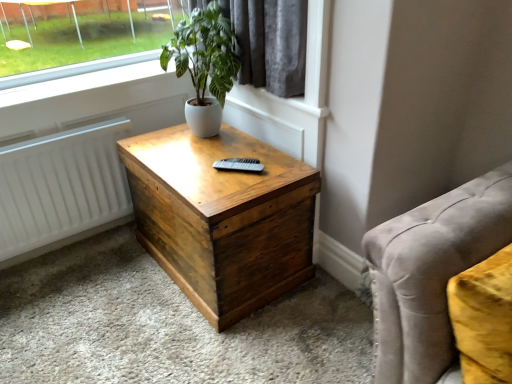
Question: From the image's perspective, is wooden nightstand at center on white matte radiator at left?

Choices:
 (A) no
 (B) yes

Answer: (A)

Question: Is wooden nightstand at center at the right side of white matte radiator at left?

Choices:
 (A) yes
 (B) no

Answer: (A)

Question: Can you confirm if wooden nightstand at center is shorter than white matte radiator at left?

Choices:
 (A) no
 (B) yes

Answer: (A)

Question: From a real-world perspective, is wooden nightstand at center under white matte radiator at left?

Choices:
 (A) yes
 (B) no

Answer: (A)

Question: Is white matte radiator at left a part of wooden nightstand at center?

Choices:
 (A) no
 (B) yes

Answer: (A)

Question: Considering the positions of point (36, 173) and point (218, 69), is point (36, 173) closer or farther from the camera than point (218, 69)?

Choices:
 (A) farther
 (B) closer

Answer: (A)

Question: Is white matte radiator at left taller or shorter than green leafy plant at upper center?

Choices:
 (A) tall
 (B) short

Answer: (B)

Question: Is white matte radiator at left in front of or behind green leafy plant at upper center in the image?

Choices:
 (A) front
 (B) behind

Answer: (B)

Question: Visually, is white matte radiator at left positioned to the left or to the right of green leafy plant at upper center?

Choices:
 (A) left
 (B) right

Answer: (A)

Question: Based on their positions, is velvet gray studio couch at lower right located to the left or right of wooden nightstand at center?

Choices:
 (A) right
 (B) left

Answer: (A)

Question: Is velvet gray studio couch at lower right inside the boundaries of wooden nightstand at center, or outside?

Choices:
 (A) outside
 (B) inside

Answer: (A)

Question: Considering the positions of velvet gray studio couch at lower right and wooden nightstand at center in the image, is velvet gray studio couch at lower right wider or thinner than wooden nightstand at center?

Choices:
 (A) thin
 (B) wide

Answer: (A)

Question: Is velvet gray studio couch at lower right in front of or behind wooden nightstand at center in the image?

Choices:
 (A) behind
 (B) front

Answer: (B)

Question: Visually, is wooden nightstand at center positioned to the left or to the right of white matte radiator at left?

Choices:
 (A) right
 (B) left

Answer: (A)

Question: From the image's perspective, is wooden nightstand at center positioned above or below white matte radiator at left?

Choices:
 (A) above
 (B) below

Answer: (B)